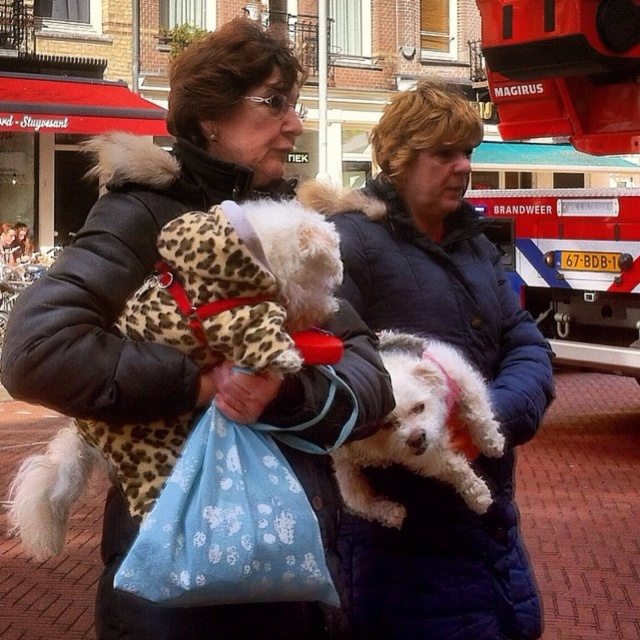
Question: Which point is farther to the camera?

Choices:
 (A) (552, 348)
 (B) (218, 248)
 (C) (484, 451)

Answer: (A)

Question: Does brushed metal fire truck at upper right lie in front of white fluffy dog at center?

Choices:
 (A) no
 (B) yes

Answer: (A)

Question: Which object is the farthest from the blue quilted jacket at center?

Choices:
 (A) white fluffy dog at center
 (B) brushed metal fire truck at upper right
 (C) white fur dog at center
 (D) blue fabric bag at center

Answer: (B)

Question: In this image, where is brushed metal fire truck at upper right located relative to white fluffy dog at center?

Choices:
 (A) below
 (B) above

Answer: (B)

Question: Which of the following is the closest to the observer?

Choices:
 (A) white fur dog at center
 (B) blue quilted jacket at center

Answer: (A)

Question: Is blue quilted jacket at center bigger than blue fabric bag at center?

Choices:
 (A) yes
 (B) no

Answer: (A)